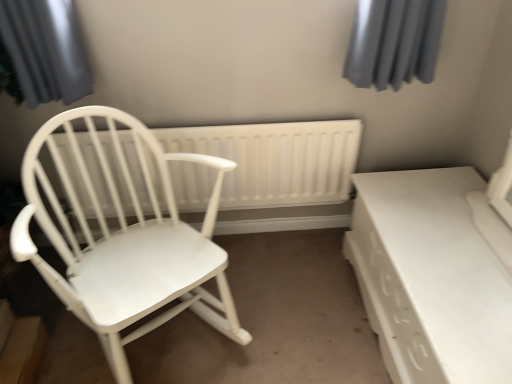
Find the location of a particular element. The width and height of the screenshot is (512, 384). unoccupied region to the right of white matte wood chair at left is located at coordinates (290, 301).